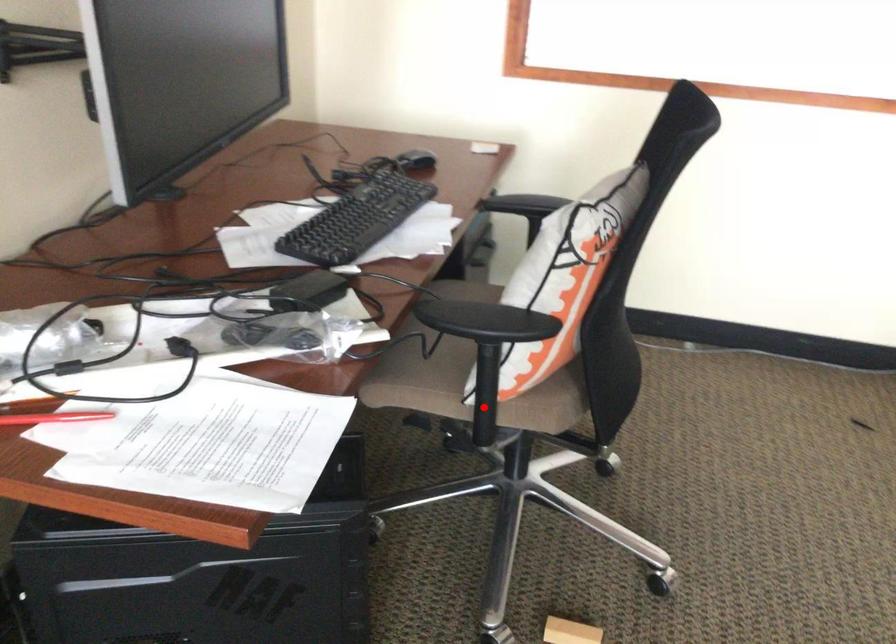
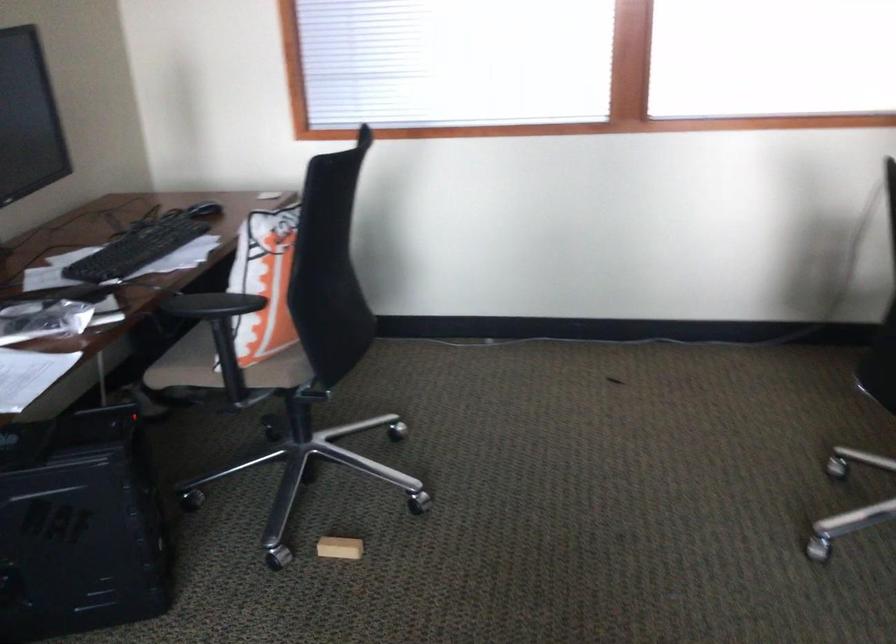
Question: A red point is marked in image1. In image2, is the corresponding 3D point closer to the camera or farther? Reply with the corresponding letter.

Choices:
 (A) The corresponding 3D point is closer.
 (B) The corresponding 3D point is farther.

Answer: (B)